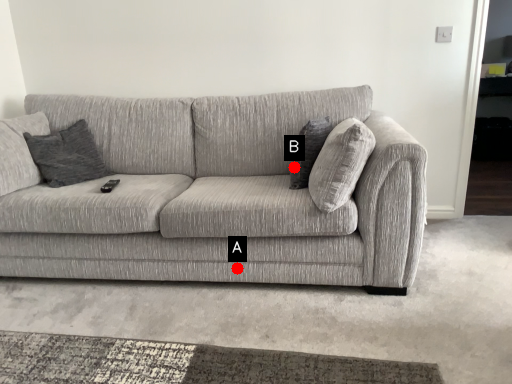
Question: Two points are circled on the image, labeled by A and B beside each circle. Which point is closer to the camera?

Choices:
 (A) A is closer
 (B) B is closer

Answer: (A)